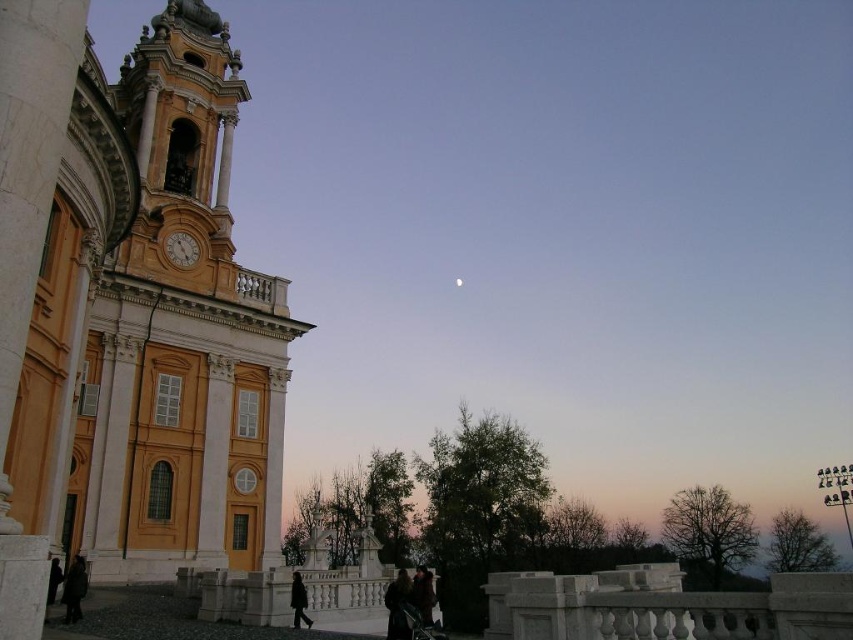
You are standing at the entrance of the yellow matte church at left and want to see the dark brown leather coat at lower center. Can you see it without moving from your current position?

The yellow matte church at left is in front of the dark brown leather coat at lower center, so the church blocks the view. You cannot see the dark brown leather coat at lower center from your current position.

You are standing at the base of the grand building and see the dark brown coat at lower left. You want to take a photo of the clock face on the bell tower. You have a camera that can focus up to 45 meters. Is the camera able to capture the clock face?

The dark brown coat at lower left and the camera are 44.87 meters apart. Since the camera can focus up to 45 meters, it is within range to capture the clock face.

You are standing in front of the grand building and notice two objects in the scene. One is the dark brown coat at lower left and the other is the white matte moon at upper center. Which object is positioned to the left of the other?

The dark brown coat at lower left is positioned to the left of the white matte moon at upper center.